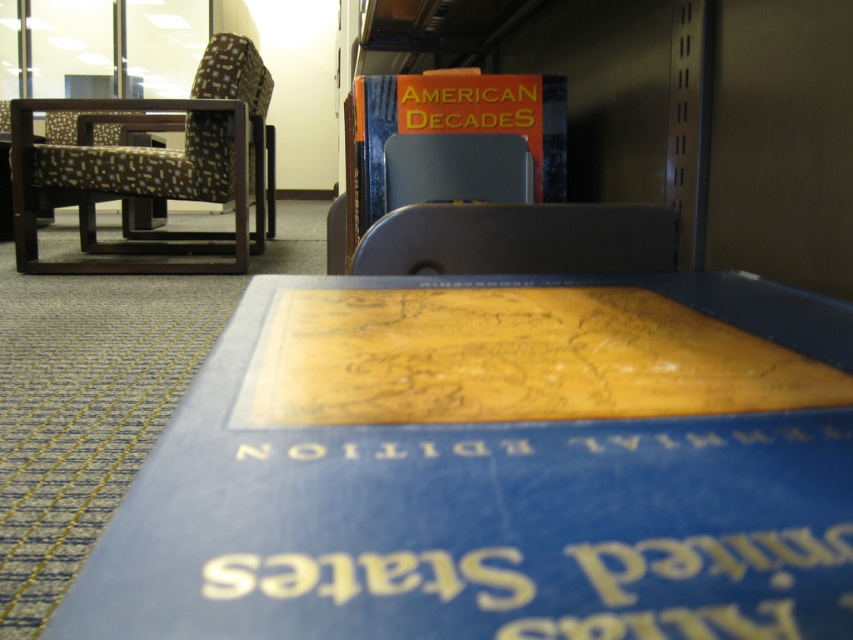
What do you see at coordinates (495, 467) in the screenshot? The width and height of the screenshot is (853, 640). I see `blue matte map at lower right` at bounding box center [495, 467].

Based on the photo, can you confirm if blue matte map at lower right is positioned to the right of orange matte book at upper center?

Incorrect, blue matte map at lower right is not on the right side of orange matte book at upper center.

The width and height of the screenshot is (853, 640). Identify the location of blue matte map at lower right. (495, 467).

Does blue matte map at lower right come behind matte plastic chair at center?

No, blue matte map at lower right is closer to the viewer.

Who is positioned more to the right, blue matte map at lower right or matte plastic chair at center?

matte plastic chair at center is more to the right.

Does point (194, 620) lie in front of point (479, 266)?

Yes, point (194, 620) is in front of point (479, 266).

The height and width of the screenshot is (640, 853). I want to click on blue matte map at lower right, so click(495, 467).

Which is in front, point (540, 141) or point (550, 273)?

Point (550, 273)

Between orange matte book at upper center and matte plastic chair at center, which one is positioned lower?

Positioned lower is matte plastic chair at center.

Does point (402, 204) come in front of point (494, 227)?

No, it is behind (494, 227).

Locate an element on the screen. The height and width of the screenshot is (640, 853). orange matte book at upper center is located at coordinates (454, 141).